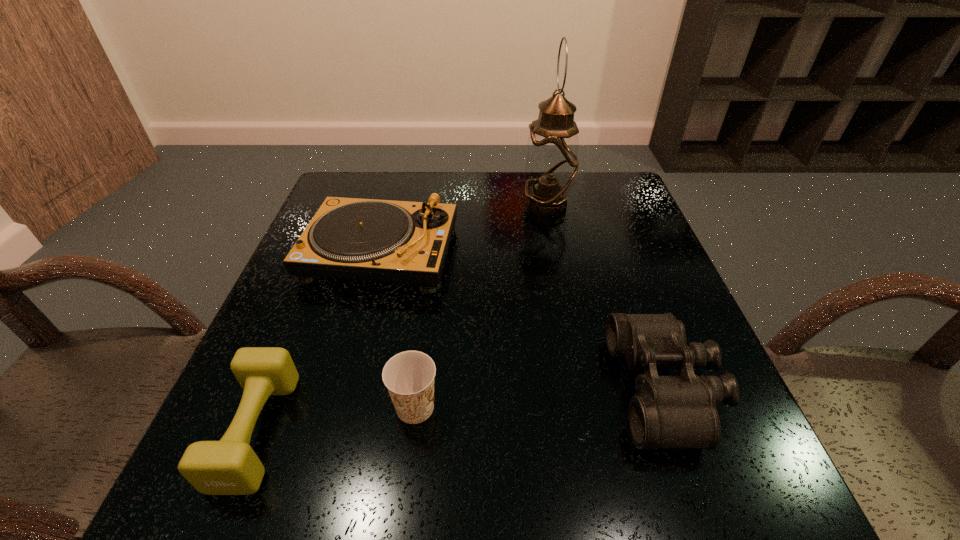
Image resolution: width=960 pixels, height=540 pixels. Find the location of `the tallest object`. the tallest object is located at coordinates (551, 164).

The image size is (960, 540). Identify the location of record player. [403, 242].

This screenshot has height=540, width=960. Identify the location of binoculars. (680, 411).

Identify the location of Dixie cup. (409, 376).

Find the location of a particular element. dumbbell is located at coordinates (230, 466).

Find the location of a particular element. free space located on the back of the tallest object is located at coordinates (541, 177).

Image resolution: width=960 pixels, height=540 pixels. Identify the location of vacant space situated 0.240m on the back of the record player. (402, 172).

Locate an element on the screen. This screenshot has height=540, width=960. free space located at the eyepieces of the binoculars is located at coordinates (577, 388).

The width and height of the screenshot is (960, 540). What are the coordinates of `free space located 0.100m at the eyepieces of the binoculars` in the screenshot? It's located at (560, 388).

This screenshot has width=960, height=540. Find the location of `vacant region located at the eyepieces of the binoculars`. vacant region located at the eyepieces of the binoculars is located at coordinates (425, 388).